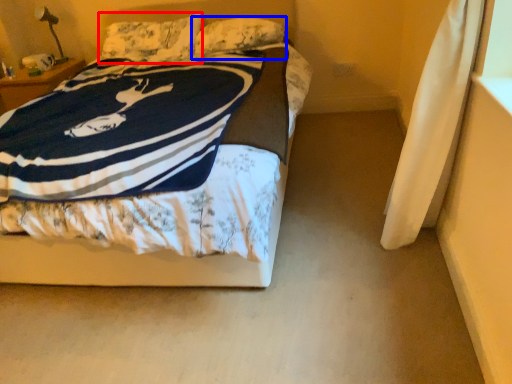
Question: Which object is further to the camera taking this photo, pillow (highlighted by a red box) or pillow (highlighted by a blue box)?

Choices:
 (A) pillow
 (B) pillow

Answer: (A)